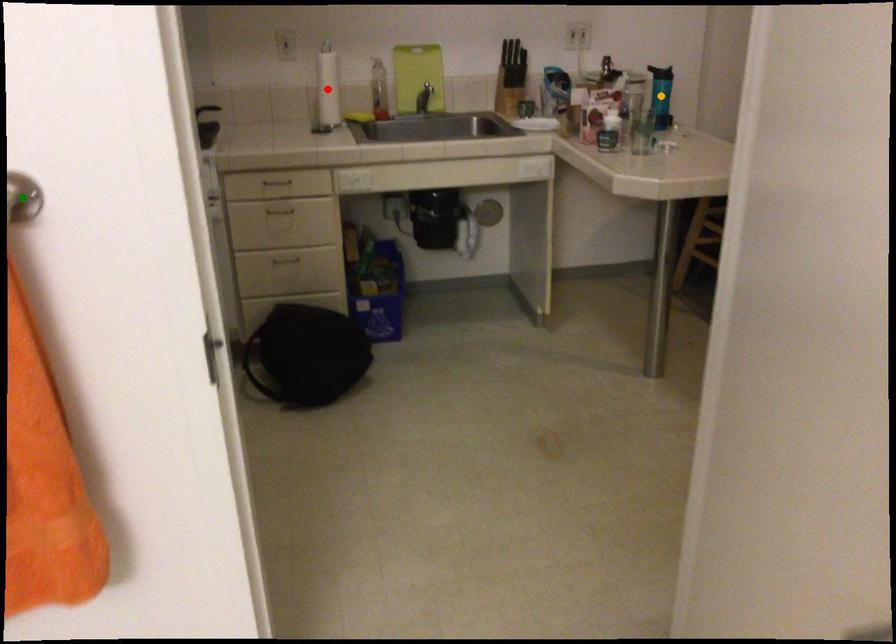
Order these from nearest to farthest:
1. red point
2. orange point
3. green point

green point → red point → orange point